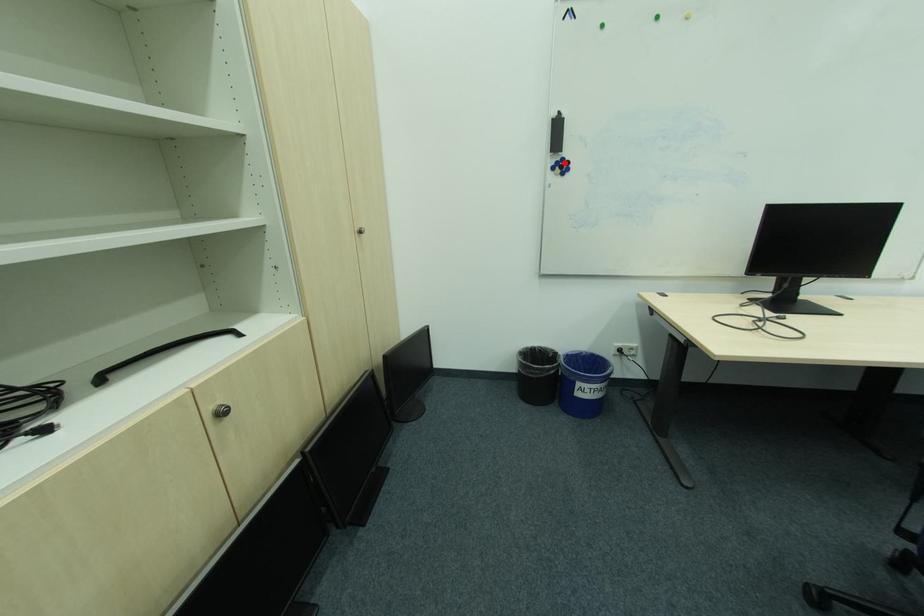
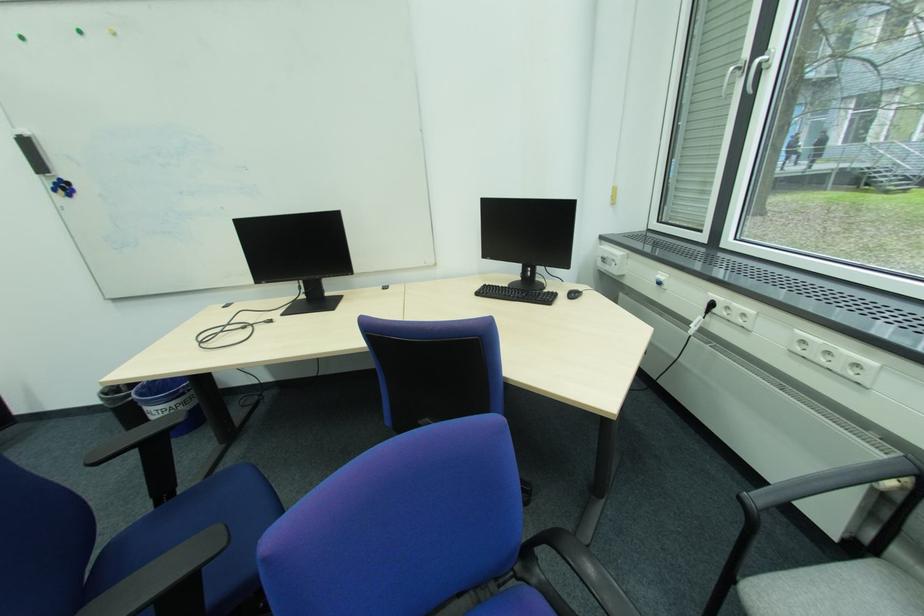
Question: I am providing you with two images of the same scene from different viewpoints. Image1 has a red point marked. In image2, the corresponding 3D location appears at what relative position? Reply with the corresponding letter.

Choices:
 (A) Closer
 (B) Farther

Answer: (B)